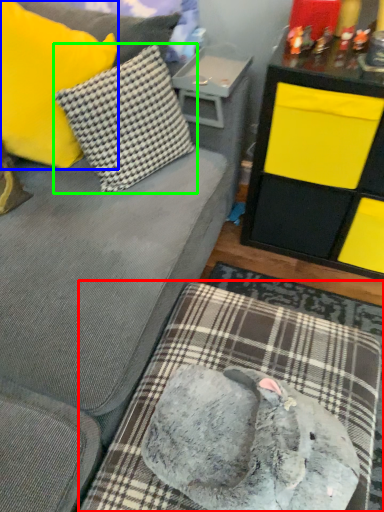
Question: Considering the real-world distances, which object is closest to dog bed (highlighted by a red box)? pillow (highlighted by a blue box) or pillow (highlighted by a green box).

Choices:
 (A) pillow
 (B) pillow

Answer: (B)